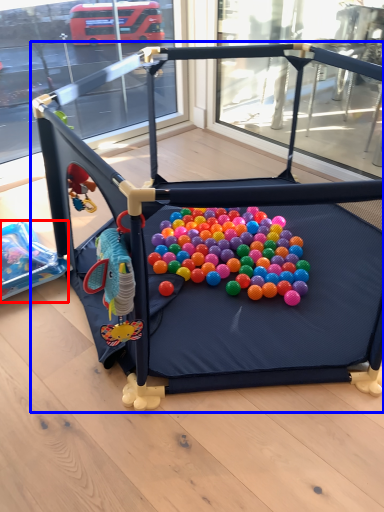
Question: Which object appears closest to the camera in this image, toy (highlighted by a red box) or toy (highlighted by a blue box)?

Choices:
 (A) toy
 (B) toy

Answer: (B)